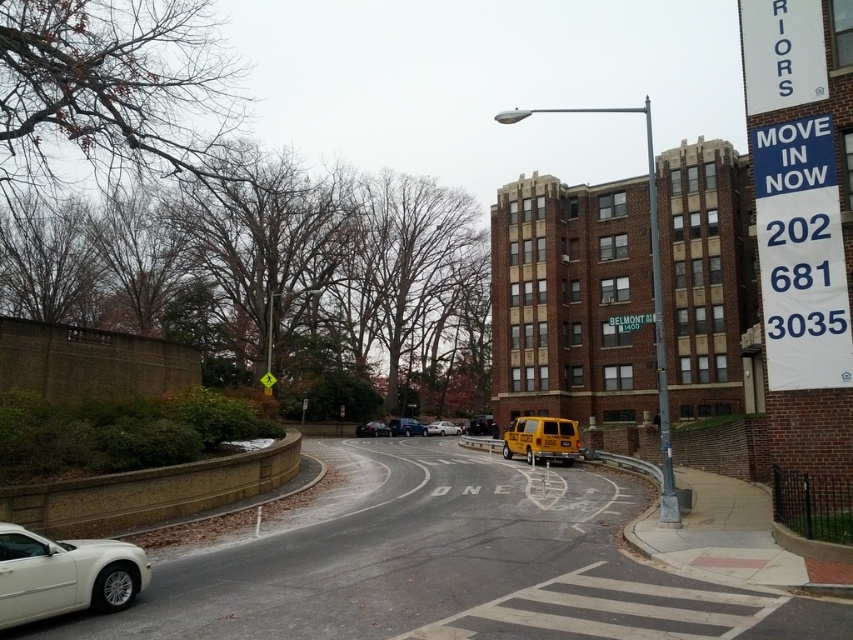
Question: Based on their relative distances, which object is nearer to the white glossy sedan at lower left?

Choices:
 (A) yellow matte school bus at center
 (B) metallic silver car at center

Answer: (A)

Question: Does white glossy sedan at lower left have a greater width compared to metallic silver car at center?

Choices:
 (A) no
 (B) yes

Answer: (A)

Question: Which point is closer to the camera?

Choices:
 (A) (477, 422)
 (B) (519, 422)
 (C) (393, 420)

Answer: (B)

Question: Is white glossy sedan at lower left above silver metallic sedan at center?

Choices:
 (A) yes
 (B) no

Answer: (A)

Question: Does yellow matte school bus at center appear under matte black van at center?

Choices:
 (A) no
 (B) yes

Answer: (A)

Question: Which of the following is the farthest from the observer?

Choices:
 (A) white glossy sedan at lower left
 (B) silver metallic sedan at center
 (C) matte black van at center
 (D) metallic silver car at center

Answer: (B)